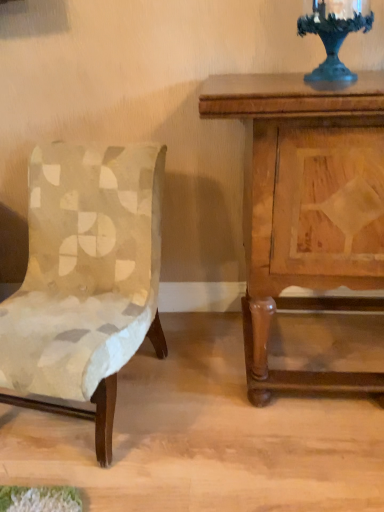
Question: Is wooden nightstand at right aimed at metallic dark blue candle holder at upper right?

Choices:
 (A) yes
 (B) no

Answer: (B)

Question: Does wooden nightstand at right touch metallic dark blue candle holder at upper right?

Choices:
 (A) no
 (B) yes

Answer: (A)

Question: Can you confirm if wooden nightstand at right is wider than metallic dark blue candle holder at upper right?

Choices:
 (A) no
 (B) yes

Answer: (B)

Question: Considering the relative sizes of wooden nightstand at right and metallic dark blue candle holder at upper right in the image provided, is wooden nightstand at right shorter than metallic dark blue candle holder at upper right?

Choices:
 (A) yes
 (B) no

Answer: (B)

Question: Is metallic dark blue candle holder at upper right surrounded by wooden nightstand at right?

Choices:
 (A) yes
 (B) no

Answer: (B)

Question: From the image's perspective, would you say wooden nightstand at right is positioned over metallic dark blue candle holder at upper right?

Choices:
 (A) no
 (B) yes

Answer: (A)

Question: Is metallic dark blue candle holder at upper right bigger than wooden nightstand at right?

Choices:
 (A) yes
 (B) no

Answer: (B)

Question: From the image's perspective, is metallic dark blue candle holder at upper right over wooden nightstand at right?

Choices:
 (A) yes
 (B) no

Answer: (A)

Question: From the image's perspective, is metallic dark blue candle holder at upper right located beneath wooden nightstand at right?

Choices:
 (A) yes
 (B) no

Answer: (B)

Question: From a real-world perspective, is metallic dark blue candle holder at upper right physically above wooden nightstand at right?

Choices:
 (A) yes
 (B) no

Answer: (A)

Question: Can you see metallic dark blue candle holder at upper right touching wooden nightstand at right?

Choices:
 (A) yes
 (B) no

Answer: (B)

Question: Considering the relative sizes of metallic dark blue candle holder at upper right and wooden nightstand at right in the image provided, is metallic dark blue candle holder at upper right shorter than wooden nightstand at right?

Choices:
 (A) no
 (B) yes

Answer: (B)

Question: Is velvet beige chair at left at the right side of wooden nightstand at right?

Choices:
 (A) no
 (B) yes

Answer: (A)